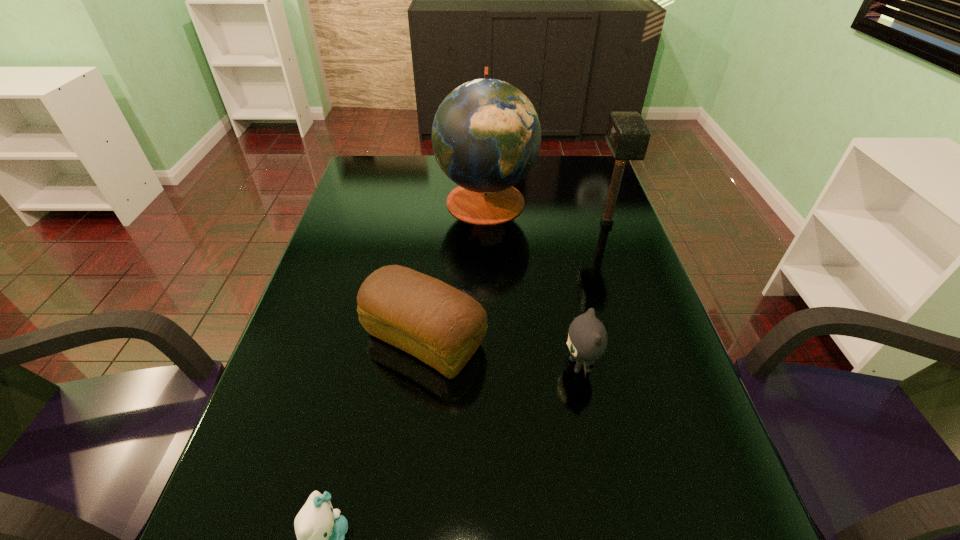
Identify the location of vacant region located on the front of the bread. (406, 495).

Find the location of `vacant space located on the front-facing side of the fourth tallest object`. vacant space located on the front-facing side of the fourth tallest object is located at coordinates (489, 366).

Locate an element on the screen. This screenshot has height=540, width=960. vacant space located 0.230m on the front-facing side of the fourth tallest object is located at coordinates (456, 366).

At what (x,y) coordinates should I click in order to perform the action: click on vacant space located 0.330m on the front-facing side of the fourth tallest object. Please return your answer as a coordinate pair (x, y). Looking at the image, I should click on [x=410, y=366].

Where is `object present at the far edge`? object present at the far edge is located at coordinates (486, 135).

Where is `object that is positioned at the right edge`? This screenshot has height=540, width=960. object that is positioned at the right edge is located at coordinates (627, 135).

The height and width of the screenshot is (540, 960). In the image, there is a desktop. Find the location of `vacant space at the far edge`. vacant space at the far edge is located at coordinates (445, 180).

Where is `free region at the left edge`? This screenshot has height=540, width=960. free region at the left edge is located at coordinates (378, 199).

What are the coordinates of `vacant space at the right edge of the desktop` in the screenshot? It's located at (629, 451).

The image size is (960, 540). I want to click on free region at the far right corner, so click(x=595, y=189).